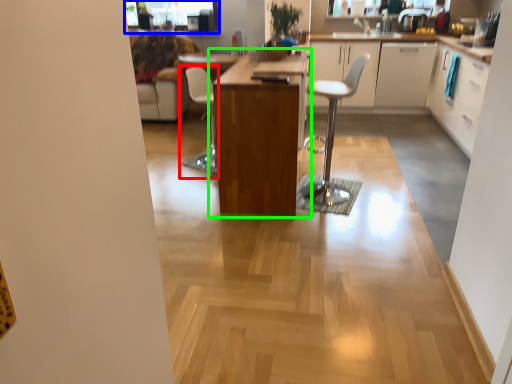
Question: Which object is the farthest from chair (highlighted by a red box)? Choose among these: window screen (highlighted by a blue box) or table (highlighted by a green box).

Choices:
 (A) window screen
 (B) table

Answer: (A)